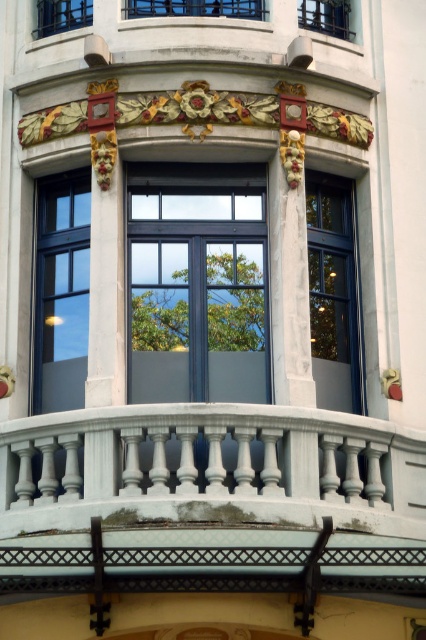
Question: Which object is farther from the camera taking this photo?

Choices:
 (A) matte black window at upper left
 (B) clear glass window at upper center

Answer: (B)

Question: Which object appears farthest from the camera in this image?

Choices:
 (A) white stone balustrade at center
 (B) clear glass window at upper center
 (C) matte black window at upper left

Answer: (B)

Question: Is white stone balustrade at center positioned before matte black window at upper left?

Choices:
 (A) no
 (B) yes

Answer: (B)

Question: Which is farther from the matte black window at upper left?

Choices:
 (A) white stone balustrade at center
 (B) clear glass window at upper center

Answer: (A)

Question: Where is white stone balustrade at center located in relation to clear glass window at upper center in the image?

Choices:
 (A) right
 (B) left

Answer: (B)

Question: Does white stone balustrade at center come in front of clear glass window at upper center?

Choices:
 (A) yes
 (B) no

Answer: (A)